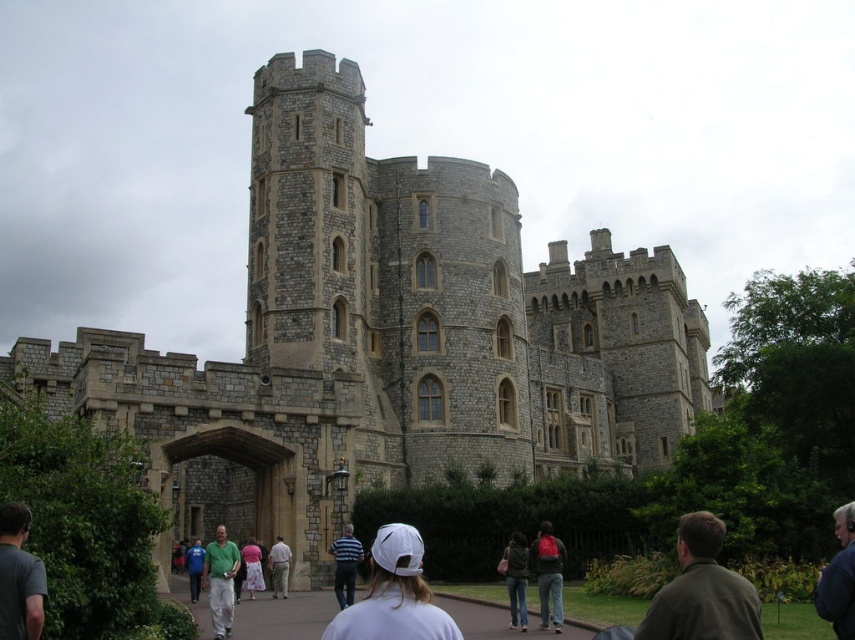
In the scene shown: You are a tailor observing a medieval castle scene. You need to determine which garment has a greater width between the dark blue jacket at lower right and the striped cotton shirt at center. Based on the scene, which one is wider?

The dark blue jacket at lower right is wider than the striped cotton shirt at center according to the description.